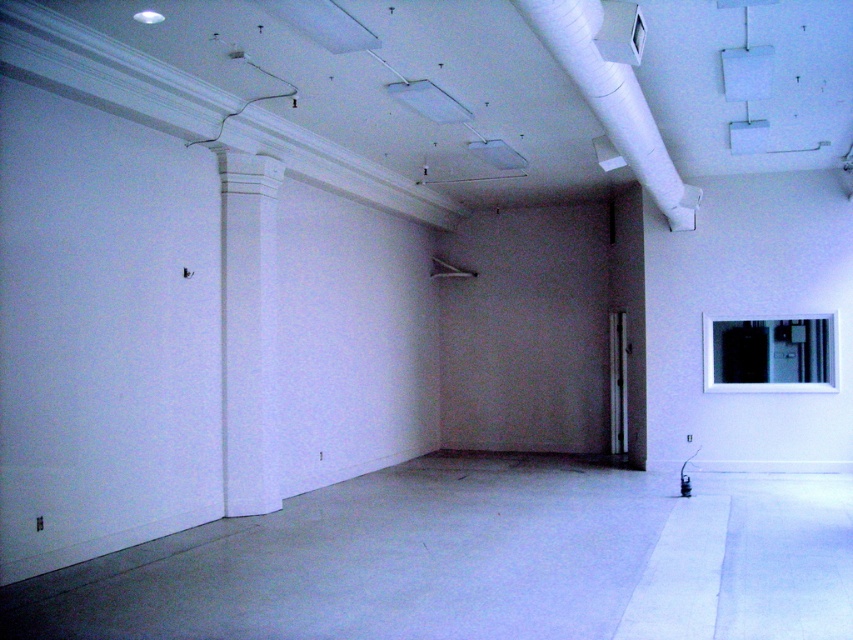
Question: Does white smooth column at left have a larger size compared to white matte pipe at upper center?

Choices:
 (A) yes
 (B) no

Answer: (A)

Question: Observing the image, what is the correct spatial positioning of white smooth column at left in reference to white matte pipe at upper center?

Choices:
 (A) left
 (B) right

Answer: (A)

Question: Which point appears closest to the camera in this image?

Choices:
 (A) (277, 486)
 (B) (515, 0)

Answer: (B)

Question: Which object is farther from the camera taking this photo?

Choices:
 (A) white smooth column at left
 (B) white matte pipe at upper center

Answer: (A)

Question: Is white smooth column at left closer to camera compared to white matte pipe at upper center?

Choices:
 (A) no
 (B) yes

Answer: (A)